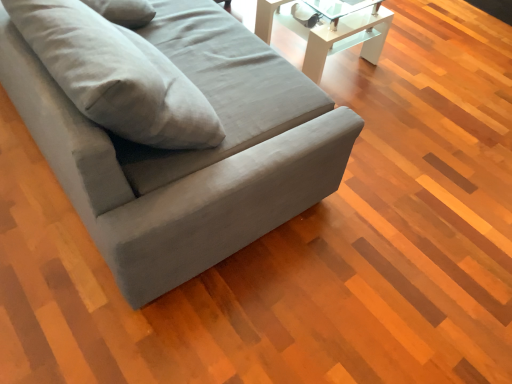
Question: Is white glossy table at upper center to the left of matte gray couch at center from the viewer's perspective?

Choices:
 (A) yes
 (B) no

Answer: (B)

Question: Considering the relative sizes of white glossy table at upper center and matte gray couch at center in the image provided, is white glossy table at upper center wider than matte gray couch at center?

Choices:
 (A) no
 (B) yes

Answer: (A)

Question: From a real-world perspective, is white glossy table at upper center on top of matte gray couch at center?

Choices:
 (A) no
 (B) yes

Answer: (A)

Question: Does white glossy table at upper center touch matte gray couch at center?

Choices:
 (A) yes
 (B) no

Answer: (B)

Question: Would you consider white glossy table at upper center to be distant from matte gray couch at center?

Choices:
 (A) no
 (B) yes

Answer: (A)

Question: Would you say matte gray couch at center is part of white glossy table at upper center's contents?

Choices:
 (A) no
 (B) yes

Answer: (A)

Question: Is matte gray couch at center facing towards white glossy table at upper center?

Choices:
 (A) yes
 (B) no

Answer: (A)

Question: Is white glossy table at upper center at the back of matte gray couch at center?

Choices:
 (A) yes
 (B) no

Answer: (B)

Question: Considering the relative positions of matte gray couch at center and white glossy table at upper center in the image provided, is matte gray couch at center in front of white glossy table at upper center?

Choices:
 (A) yes
 (B) no

Answer: (A)

Question: From the image's perspective, is matte gray couch at center below white glossy table at upper center?

Choices:
 (A) yes
 (B) no

Answer: (A)

Question: Can you confirm if matte gray couch at center is thinner than white glossy table at upper center?

Choices:
 (A) no
 (B) yes

Answer: (A)

Question: Is matte gray couch at center far from white glossy table at upper center?

Choices:
 (A) yes
 (B) no

Answer: (B)

Question: In the image, is white glossy table at upper center positioned in front of or behind matte gray couch at center?

Choices:
 (A) behind
 (B) front

Answer: (A)